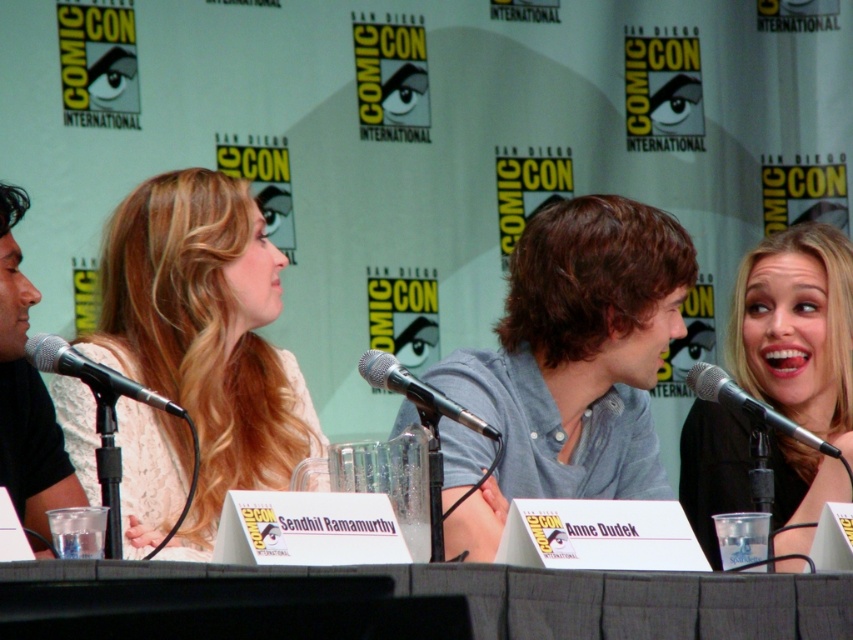
Question: Is gray fabric table at center above silver metallic microphone at left?

Choices:
 (A) no
 (B) yes

Answer: (A)

Question: Which of the following is the farthest from the observer?

Choices:
 (A) white lace dress at left
 (B) black matte hair at upper right
 (C) silver metallic microphone at left
 (D) black metallic microphone at upper right

Answer: (A)

Question: In this image, where is silver metallic microphone at left located relative to black metallic microphone at upper right?

Choices:
 (A) left
 (B) right

Answer: (A)

Question: Is black metallic microphone at center wider than silver metallic microphone at left?

Choices:
 (A) yes
 (B) no

Answer: (B)

Question: Estimate the real-world distances between objects in this image. Which object is closer to the black metallic microphone at upper right?

Choices:
 (A) white lace dress at left
 (B) black metallic microphone at center
 (C) gray cotton shirt at center

Answer: (C)

Question: Which point is farther to the camera?

Choices:
 (A) silver metallic microphone at left
 (B) white lace dress at left
 (C) black metallic microphone at center
 (D) black metallic microphone at upper right

Answer: (B)